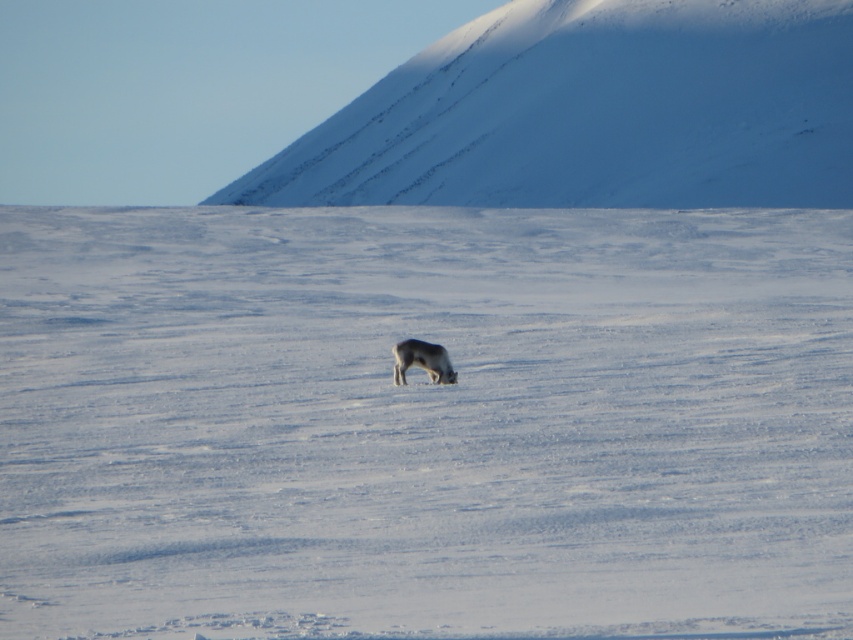
Question: In this image, where is snowy white mountain at upper center located relative to furry white reindeer at center?

Choices:
 (A) above
 (B) below

Answer: (A)

Question: Which object is the farthest from the white fluffy snow at center?

Choices:
 (A) snowy white mountain at upper center
 (B) furry white reindeer at center

Answer: (A)

Question: Does snowy white mountain at upper center appear on the right side of furry white reindeer at center?

Choices:
 (A) yes
 (B) no

Answer: (B)

Question: Estimate the real-world distances between objects in this image. Which object is closer to the white fluffy snow at center?

Choices:
 (A) snowy white mountain at upper center
 (B) furry white reindeer at center

Answer: (B)

Question: Which of these objects is positioned closest to the snowy white mountain at upper center?

Choices:
 (A) white fluffy snow at center
 (B) furry white reindeer at center

Answer: (A)

Question: In this image, where is white fluffy snow at center located relative to snowy white mountain at upper center?

Choices:
 (A) right
 (B) left

Answer: (A)